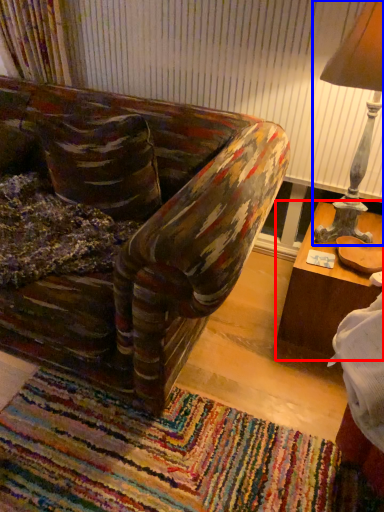
Question: Which of the following is the closest to the observer, table (highlighted by a red box) or table lamp (highlighted by a blue box)?

Choices:
 (A) table
 (B) table lamp

Answer: (B)